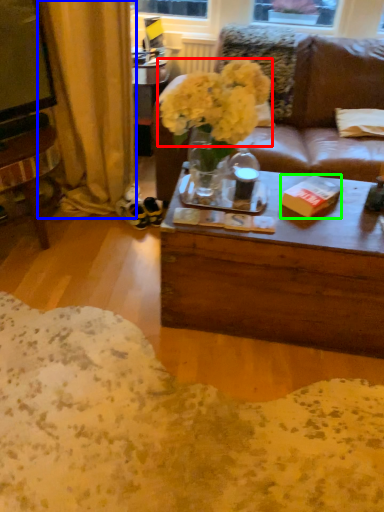
Question: Considering the real-world distances, which object is closest to flower (highlighted by a red box)? curtain (highlighted by a blue box) or book (highlighted by a green box).

Choices:
 (A) curtain
 (B) book

Answer: (B)